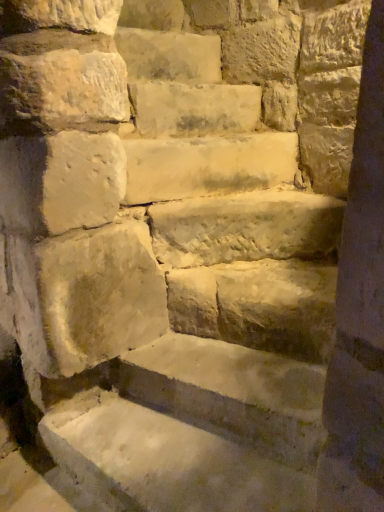
Question: From the image's perspective, is light beige stone at center, the second brick positioned from the top, located above smooth beige stone steps at center?

Choices:
 (A) yes
 (B) no

Answer: (A)

Question: Is light beige stone at center, the second brick positioned from the top, completely or partially outside of smooth beige stone steps at center?

Choices:
 (A) yes
 (B) no

Answer: (A)

Question: From a real-world perspective, is light beige stone at center, which is the first brick in bottom-to-top order, on smooth beige stone steps at center?

Choices:
 (A) yes
 (B) no

Answer: (A)

Question: Is light beige stone at center, which is the first brick in bottom-to-top order, oriented towards smooth beige stone steps at center?

Choices:
 (A) no
 (B) yes

Answer: (A)

Question: Are light beige stone at center, which is the first brick in bottom-to-top order, and smooth beige stone steps at center located far from each other?

Choices:
 (A) yes
 (B) no

Answer: (B)

Question: From the image's perspective, is light beige stone at upper center, the second brick in the bottom-to-top sequence, positioned above or below smooth beige stone at center?

Choices:
 (A) below
 (B) above

Answer: (B)

Question: Would you say light beige stone at upper center, the second brick in the bottom-to-top sequence, is inside or outside smooth beige stone at center?

Choices:
 (A) inside
 (B) outside

Answer: (B)

Question: Is light beige stone at upper center, marked as the 1th brick in a top-to-bottom arrangement, in front of or behind smooth beige stone at center in the image?

Choices:
 (A) front
 (B) behind

Answer: (B)

Question: Is point (152, 57) closer or farther from the camera than point (208, 159)?

Choices:
 (A) farther
 (B) closer

Answer: (A)

Question: Would you say light beige stone at center, which is the first brick in bottom-to-top order, is inside or outside smooth beige stone steps at center?

Choices:
 (A) inside
 (B) outside

Answer: (B)

Question: Would you say light beige stone at center, the second brick positioned from the top, is to the left or to the right of smooth beige stone steps at center in the picture?

Choices:
 (A) left
 (B) right

Answer: (A)

Question: From a real-world perspective, is light beige stone at center, the second brick positioned from the top, above or below smooth beige stone steps at center?

Choices:
 (A) below
 (B) above

Answer: (B)

Question: Does point (188, 118) appear closer or farther from the camera than point (208, 239)?

Choices:
 (A) closer
 (B) farther

Answer: (B)

Question: Relative to smooth beige stone steps at center, is smooth beige stone at center in front or behind?

Choices:
 (A) behind
 (B) front

Answer: (A)

Question: From a real-world perspective, relative to smooth beige stone steps at center, is smooth beige stone at center vertically above or below?

Choices:
 (A) above
 (B) below

Answer: (A)